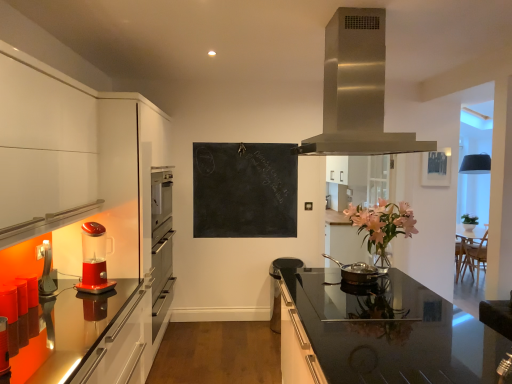
Question: Is metallic silver picture frame at upper right surrounded by black chalkboard at center?

Choices:
 (A) no
 (B) yes

Answer: (A)

Question: Considering the relative sizes of black chalkboard at center and metallic silver picture frame at upper right in the image provided, is black chalkboard at center smaller than metallic silver picture frame at upper right?

Choices:
 (A) no
 (B) yes

Answer: (A)

Question: Could you tell me if black chalkboard at center is turned towards metallic silver picture frame at upper right?

Choices:
 (A) no
 (B) yes

Answer: (A)

Question: From a real-world perspective, is black chalkboard at center positioned under metallic silver picture frame at upper right based on gravity?

Choices:
 (A) yes
 (B) no

Answer: (A)

Question: From a real-world perspective, is black chalkboard at center over metallic silver picture frame at upper right?

Choices:
 (A) no
 (B) yes

Answer: (A)

Question: Is black chalkboard at center further to camera compared to metallic silver picture frame at upper right?

Choices:
 (A) no
 (B) yes

Answer: (A)

Question: Is stainless steel range hood at upper center facing towards black glass countertop at center?

Choices:
 (A) yes
 (B) no

Answer: (B)

Question: Is stainless steel range hood at upper center at the right side of black glass countertop at center?

Choices:
 (A) no
 (B) yes

Answer: (A)

Question: From a real-world perspective, does stainless steel range hood at upper center stand above black glass countertop at center?

Choices:
 (A) yes
 (B) no

Answer: (A)

Question: Are stainless steel range hood at upper center and black glass countertop at center far apart?

Choices:
 (A) no
 (B) yes

Answer: (B)

Question: Does stainless steel range hood at upper center have a greater height compared to black glass countertop at center?

Choices:
 (A) yes
 (B) no

Answer: (B)

Question: Could black glass countertop at center be considered to be inside stainless steel range hood at upper center?

Choices:
 (A) no
 (B) yes

Answer: (A)

Question: Considering the relative sizes of translucent red blender at left, arranged as the second kitchen appliance when viewed from the right, and bronze metallic pan at center, the first kitchen appliance viewed from the right, in the image provided, is translucent red blender at left, arranged as the second kitchen appliance when viewed from the right, bigger than bronze metallic pan at center, the first kitchen appliance viewed from the right,?

Choices:
 (A) yes
 (B) no

Answer: (A)